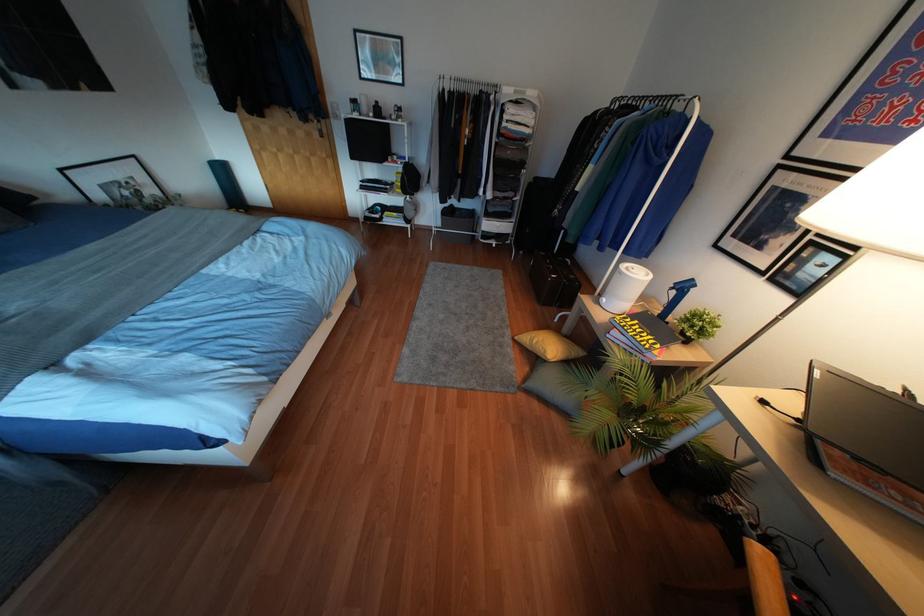
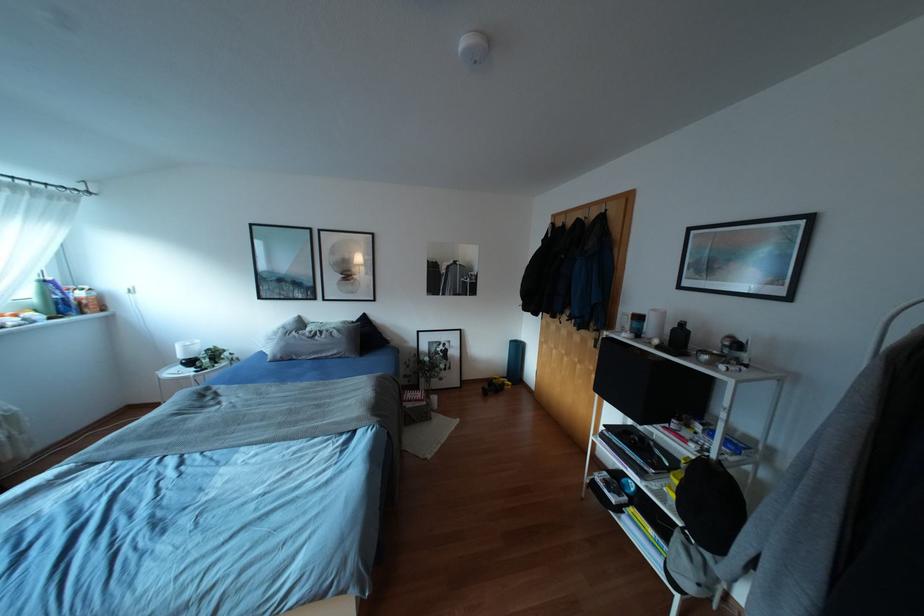
In the second image, find the point that corresponds to [375,102] in the first image.

(682, 323)